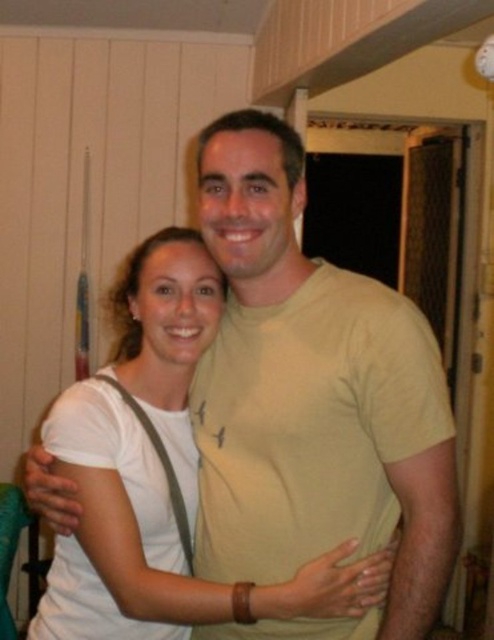
Does light beige t-shirt at center have a greater height compared to white matte shirt at center?

Correct, light beige t-shirt at center is much taller as white matte shirt at center.

What do you see at coordinates (313, 394) in the screenshot?
I see `light beige t-shirt at center` at bounding box center [313, 394].

The width and height of the screenshot is (494, 640). Identify the location of light beige t-shirt at center. (313, 394).

Identify the location of light beige t-shirt at center. (313, 394).